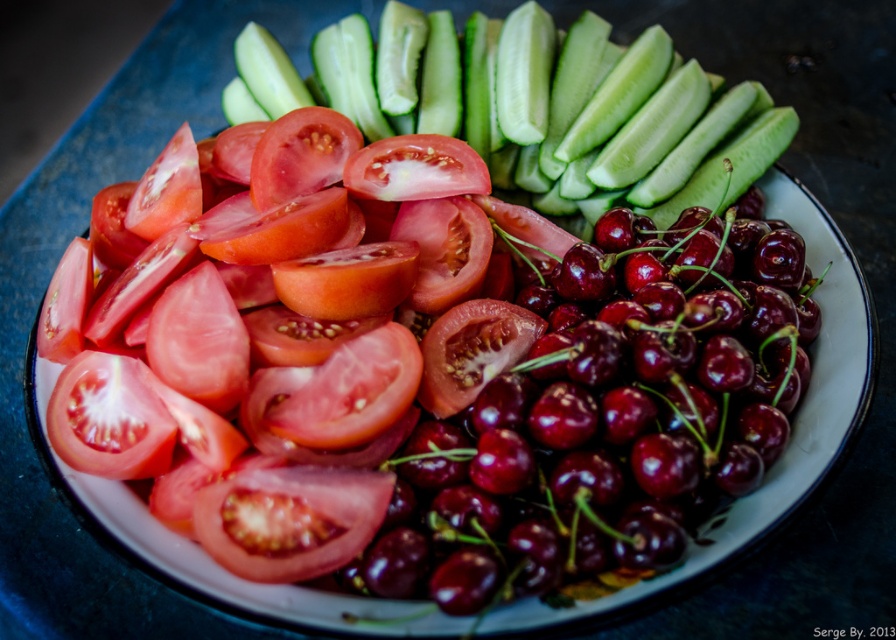
Question: Can you confirm if shiny red tomato at center is positioned below shiny red cherry at center?

Choices:
 (A) no
 (B) yes

Answer: (A)

Question: Does shiny red tomato at center have a greater width compared to shiny red cherry at center?

Choices:
 (A) no
 (B) yes

Answer: (B)

Question: Which is farther from the shiny red tomato at center?

Choices:
 (A) green smooth cucumber at upper center
 (B) shiny red cherry at center

Answer: (A)

Question: Among these points, which one is farthest from the camera?

Choices:
 (A) (323, 81)
 (B) (742, 397)
 (C) (423, 212)

Answer: (A)

Question: Is shiny red tomato at center further to camera compared to green smooth cucumber at upper center?

Choices:
 (A) yes
 (B) no

Answer: (B)

Question: Which object is the closest to the shiny red cherry at center?

Choices:
 (A) shiny red tomato at center
 (B) green smooth cucumber at upper center

Answer: (A)